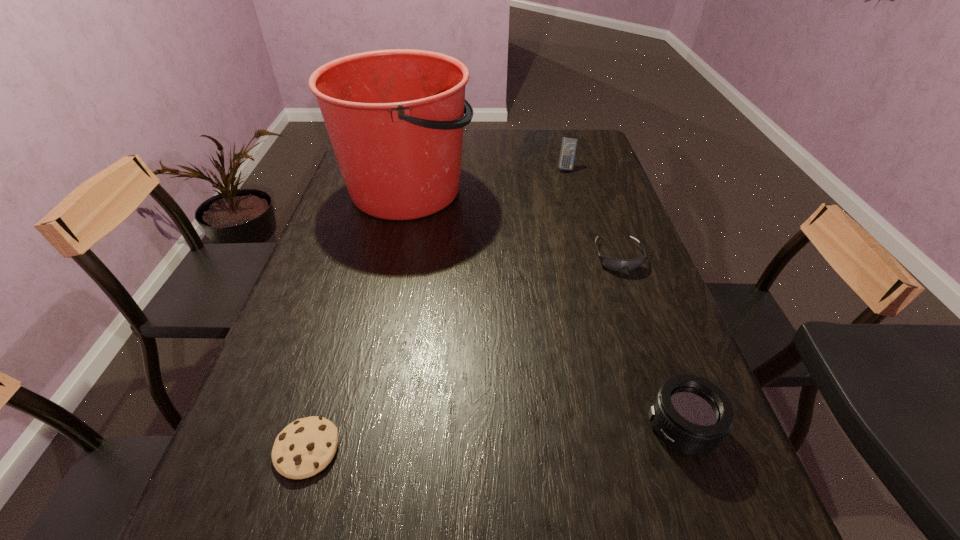
I want to click on vacant space at the left edge of the desktop, so click(x=345, y=202).

Identify the location of free space at the right edge of the desktop. 618,285.

The image size is (960, 540). In the image, there is a desktop. What are the coordinates of `vacant space at the far right corner` in the screenshot? It's located at (590, 141).

Identify the location of vacant area that lies between the calculator and the telephoto lens. The width and height of the screenshot is (960, 540). (624, 298).

This screenshot has height=540, width=960. I want to click on vacant point located between the cookie and the calculator, so click(436, 308).

You are a GUI agent. You are given a task and a screenshot of the screen. Output one action in this format:
    pyautogui.click(x=<x>, y=<y>)
    Task: Click on the vacant point located between the third farthest object and the cookie
    The height and width of the screenshot is (540, 960).
    Given the screenshot: What is the action you would take?
    pyautogui.click(x=463, y=353)

Where is `vacant space that is in between the tallest object and the telephoto lens`? This screenshot has width=960, height=540. vacant space that is in between the tallest object and the telephoto lens is located at coordinates (544, 308).

In order to click on free space between the cookie and the goggles in this screenshot , I will do `click(463, 353)`.

I want to click on empty location between the calculator and the bucket, so click(487, 179).

I want to click on free space between the tallest object and the fourth shortest object, so click(487, 179).